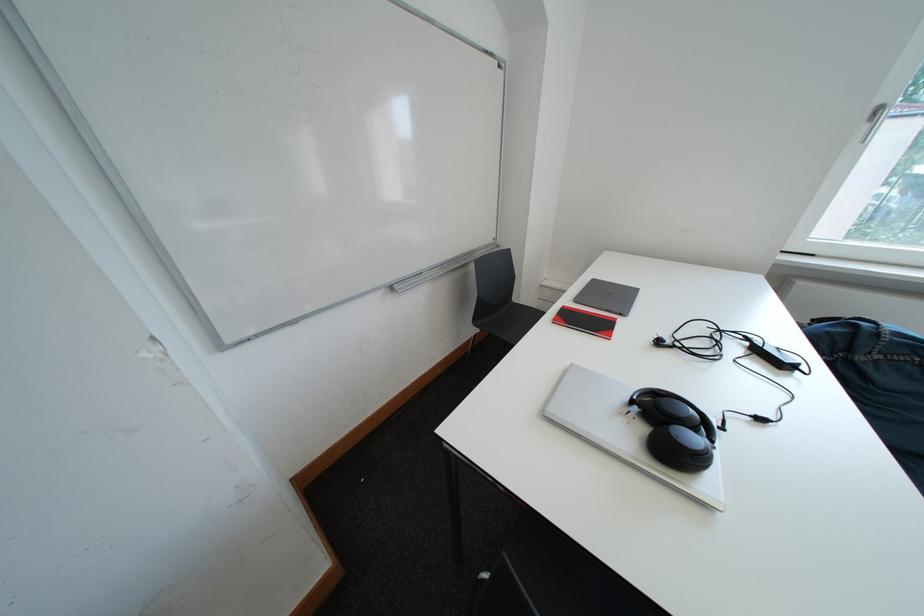
What do you see at coordinates (660, 342) in the screenshot? This screenshot has width=924, height=616. I see `a black power plug` at bounding box center [660, 342].